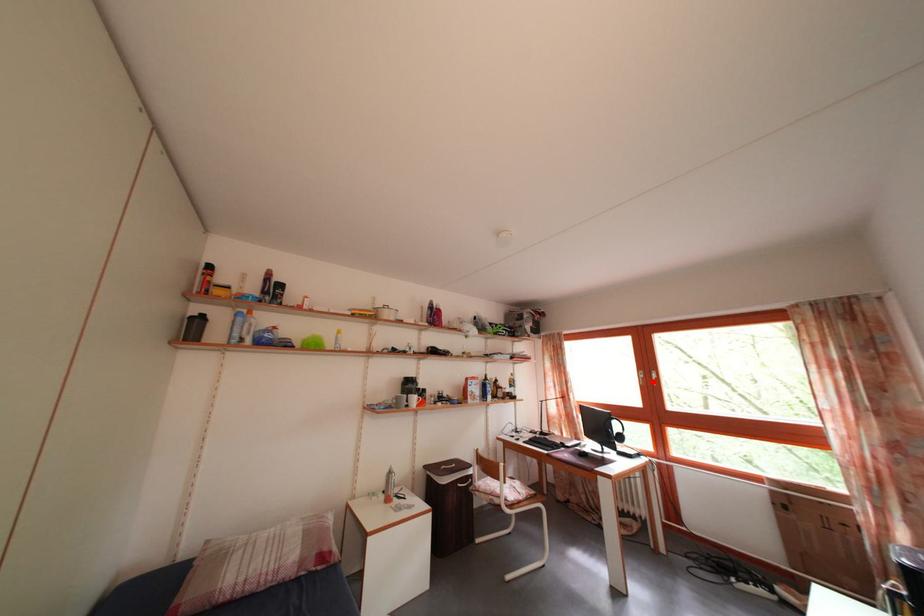
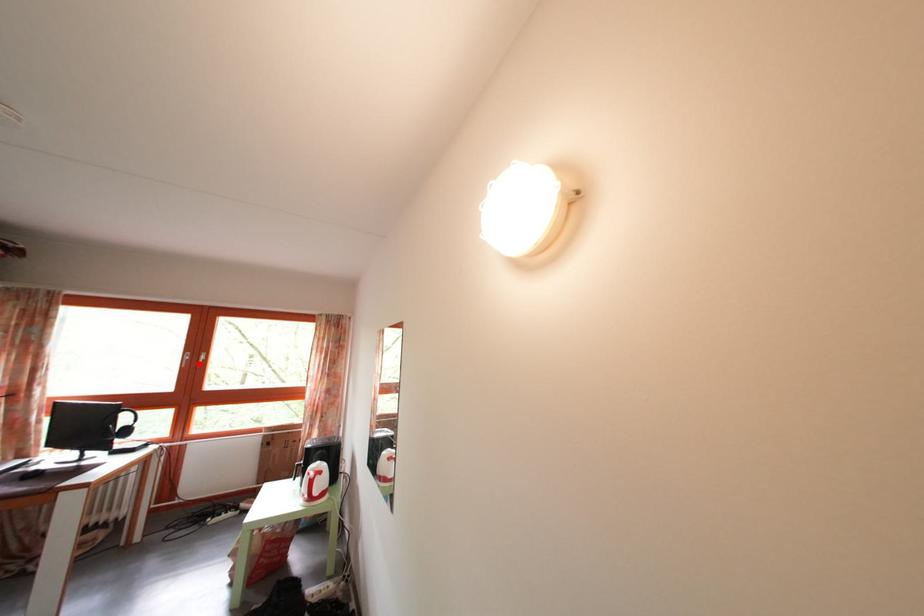
I am providing you with two images of the same scene from different viewpoints. A red point is marked on the first image and another point is marked on the second image. Does the point marked in image1 correspond to the same location as the one in image2?

Yes